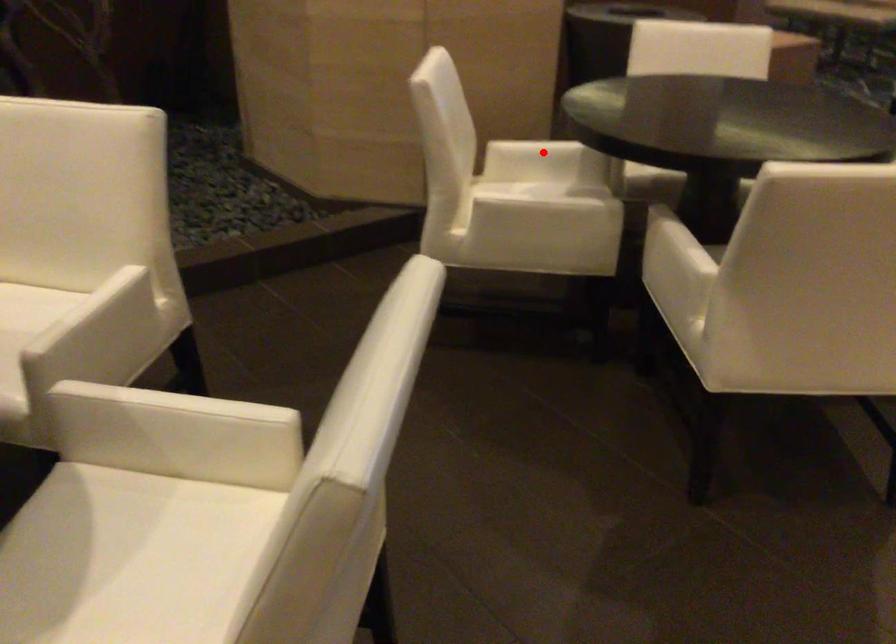
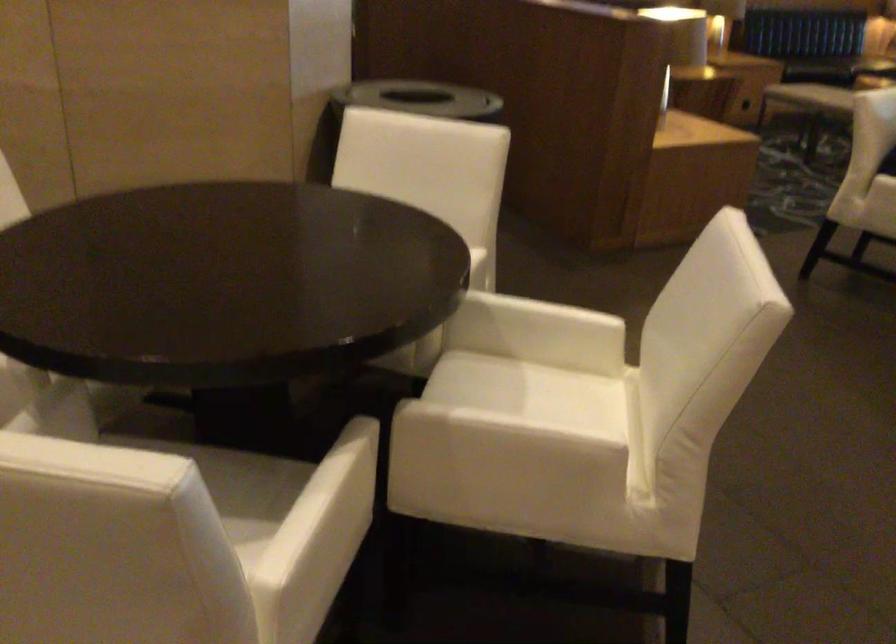
Question: I am providing you with two images of the same scene from different viewpoints. A red point is marked on the first image. At the location where the point appears in image 1, is it still visible in image 2?

Choices:
 (A) Yes
 (B) No

Answer: (B)